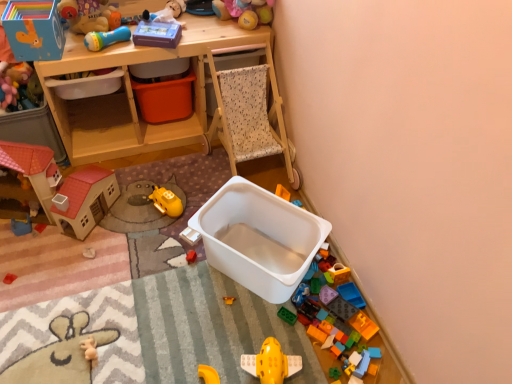
Question: Considering the relative sizes of orange plastic storage box at center, which ranks as the second storage box in right-to-left order, and translucent plastic toy blocks at lower right, placed as the 4th toy when sorted from bottom to top, in the image provided, is orange plastic storage box at center, which ranks as the second storage box in right-to-left order, shorter than translucent plastic toy blocks at lower right, placed as the 4th toy when sorted from bottom to top,?

Choices:
 (A) yes
 (B) no

Answer: (B)

Question: Is orange plastic storage box at center, which ranks as the third storage box in left-to-right order, next to translucent plastic toy blocks at lower right, positioned as the 7th toy in top-to-bottom order, and touching it?

Choices:
 (A) yes
 (B) no

Answer: (B)

Question: From a real-world perspective, is orange plastic storage box at center, which ranks as the third storage box in left-to-right order, below translucent plastic toy blocks at lower right, which is the 9th toy from left to right?

Choices:
 (A) no
 (B) yes

Answer: (A)

Question: Is orange plastic storage box at center, which ranks as the second storage box in right-to-left order, positioned far away from translucent plastic toy blocks at lower right, positioned as the 7th toy in top-to-bottom order?

Choices:
 (A) yes
 (B) no

Answer: (A)

Question: Considering the relative sizes of orange plastic storage box at center, which ranks as the second storage box in right-to-left order, and translucent plastic toy blocks at lower right, acting as the 2th toy starting from the right, in the image provided, is orange plastic storage box at center, which ranks as the second storage box in right-to-left order, bigger than translucent plastic toy blocks at lower right, acting as the 2th toy starting from the right,?

Choices:
 (A) yes
 (B) no

Answer: (A)

Question: Is orange plastic storage box at center, which ranks as the second storage box in right-to-left order, positioned with its back to translucent plastic toy blocks at lower right, which is the 9th toy from left to right?

Choices:
 (A) no
 (B) yes

Answer: (A)

Question: Are translucent plastic toy blocks at lower right, which is the 9th toy from left to right, and white plastic container at center-left, which is the 3th storage box in right-to-left order, beside each other?

Choices:
 (A) yes
 (B) no

Answer: (B)

Question: Considering the relative sizes of translucent plastic toy blocks at lower right, placed as the 4th toy when sorted from bottom to top, and white plastic container at center-left, which is the 3th storage box in right-to-left order, in the image provided, is translucent plastic toy blocks at lower right, placed as the 4th toy when sorted from bottom to top, bigger than white plastic container at center-left, which is the 3th storage box in right-to-left order,?

Choices:
 (A) yes
 (B) no

Answer: (B)

Question: Could you tell me if translucent plastic toy blocks at lower right, placed as the 4th toy when sorted from bottom to top, is facing white plastic container at center-left, which is the 3th storage box in right-to-left order?

Choices:
 (A) no
 (B) yes

Answer: (A)

Question: Is translucent plastic toy blocks at lower right, which is the 9th toy from left to right, not near white plastic container at center-left, marked as the second storage box in a left-to-right arrangement?

Choices:
 (A) yes
 (B) no

Answer: (A)

Question: Can you confirm if translucent plastic toy blocks at lower right, which is the 9th toy from left to right, is smaller than white plastic container at center-left, which is the 3th storage box in right-to-left order?

Choices:
 (A) yes
 (B) no

Answer: (A)

Question: Does translucent plastic toy blocks at lower right, which is the 9th toy from left to right, have a greater width compared to white plastic container at center-left, which is the 3th storage box in right-to-left order?

Choices:
 (A) yes
 (B) no

Answer: (B)

Question: Is blue plastic toy at left, arranged as the 6th toy when ordered from the bottom, in front of soft plush toy at upper center, which is the sixth toy from left to right?

Choices:
 (A) yes
 (B) no

Answer: (A)